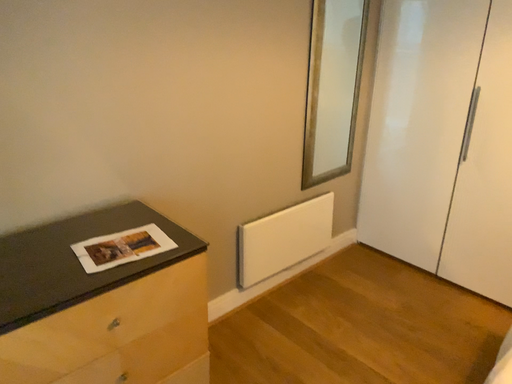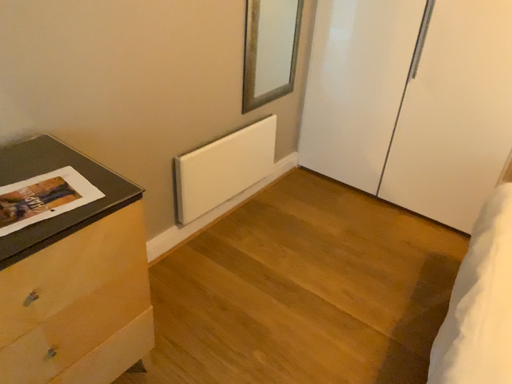
Question: How did the camera likely rotate when shooting the video?

Choices:
 (A) rotated downward
 (B) rotated upward

Answer: (A)